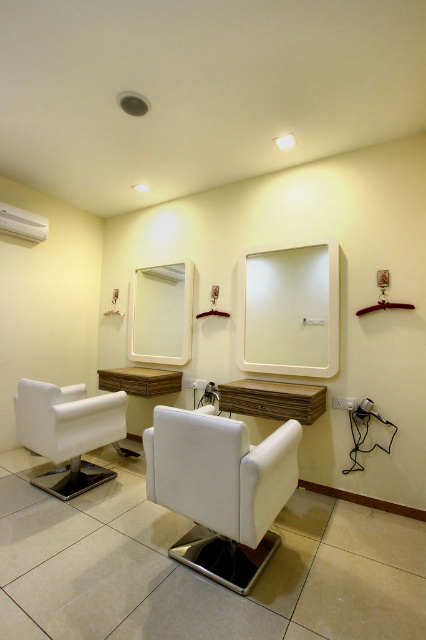
Question: Is white leather armchair at lower left below matte white mirror at upper left?

Choices:
 (A) yes
 (B) no

Answer: (A)

Question: Is white leather armchair at lower left closer to camera compared to white plastic faucet at center?

Choices:
 (A) yes
 (B) no

Answer: (A)

Question: Which of the following is the closest to the observer?

Choices:
 (A) (140, 372)
 (B) (256, 333)
 (C) (245, 593)
 (D) (212, 394)

Answer: (C)

Question: Which object is the closest to the white leather armchair at center?

Choices:
 (A) white glossy mirror at center
 (B) matte white mirror at upper left

Answer: (A)

Question: Can you confirm if matte white mirror at upper left is positioned to the left of white plastic faucet at center?

Choices:
 (A) no
 (B) yes

Answer: (B)

Question: Estimate the real-world distances between objects in this image. Which object is closer to the white plastic faucet at center?

Choices:
 (A) white leather armchair at center
 (B) wooden vanity at center

Answer: (B)